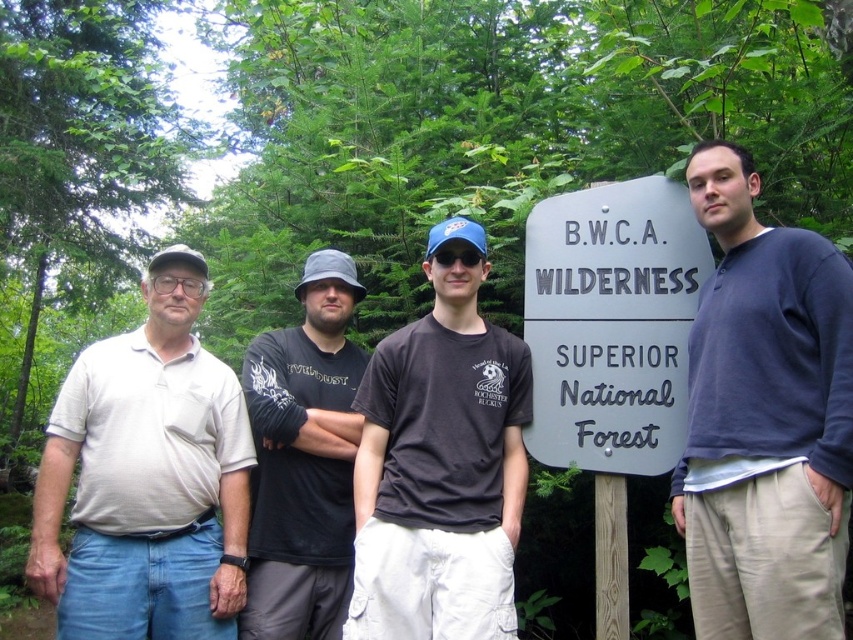
You are a photographer standing 2 meters away from the beige cotton polo shirt at left and the black matte shirt at center. You want to take a photo that includes both of them without any part of them being cut off. What is the minimum width of your camera lens in centimeters to capture both subjects?

The beige cotton polo shirt at left and black matte shirt at center are 45.71 centimeters apart. To include both subjects without any part being cut off, the camera lens must be at least 45.71 centimeters wide.

In the scene shown: What is located at the coordinates point (x=764, y=419)?

The dark blue sweater at center is located at point (x=764, y=419).

You are a photographer taking a group photo of the dark blue sweater at center and the black matte shirt at center. Which clothing item should you focus on first if you want to ensure both are in focus, given their positions relative to the camera?

The dark blue sweater at center should be focused on first because it is located above the black matte shirt at center, so focusing on it first will help ensure both are in focus.